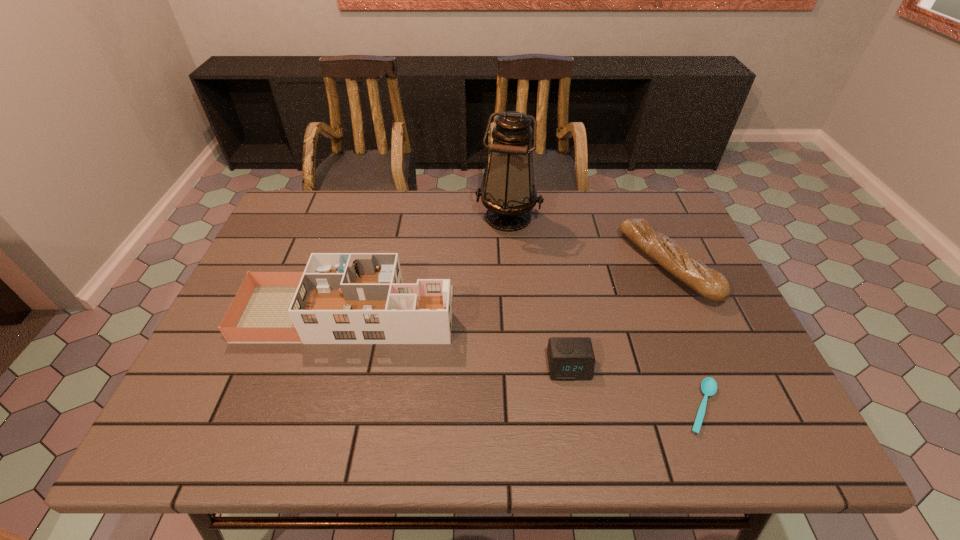
You are a GUI agent. You are given a task and a screenshot of the screen. Output one action in this format:
    pyautogui.click(x=<x>, y=<y>)
    Task: Click on the free space between the fourth tallest object and the spoon
    The height and width of the screenshot is (540, 960).
    Given the screenshot: What is the action you would take?
    pyautogui.click(x=636, y=387)

Locate an element on the screen. The width and height of the screenshot is (960, 540). vacant region between the spoon and the fourth tallest object is located at coordinates (636, 387).

At what (x,y) coordinates should I click in order to perform the action: click on free space between the third shortest object and the oil lamp. Please return your answer as a coordinate pair (x, y). This screenshot has height=540, width=960. Looking at the image, I should click on [588, 241].

Identify the location of vacant area that lies between the third shortest object and the oil lamp. (588, 241).

Where is `empty location between the second shortest object and the leftmost object`? The image size is (960, 540). empty location between the second shortest object and the leftmost object is located at coordinates (458, 340).

Locate which object ranks in proximity to the shortest object. Please provide its 2D coordinates. Your answer should be formatted as a tuple, i.e. [(x, y)], where the tuple contains the x and y coordinates of a point satisfying the conditions above.

[(569, 358)]

Select which object appears as the second closest to the second tallest object. Please provide its 2D coordinates. Your answer should be formatted as a tuple, i.e. [(x, y)], where the tuple contains the x and y coordinates of a point satisfying the conditions above.

[(569, 358)]

You are a GUI agent. You are given a task and a screenshot of the screen. Output one action in this format:
    pyautogui.click(x=<x>, y=<y>)
    Task: Click on the blank area in the image that satisfies the following two spatial constraints: 1. on the front-facing side of the fourth tallest object; 2. on the right side of the shortest object
    This screenshot has height=540, width=960.
    Given the screenshot: What is the action you would take?
    pyautogui.click(x=576, y=407)

At what (x,y) coordinates should I click in order to perform the action: click on free location that satisfies the following two spatial constraints: 1. on the front side of the spoon; 2. on the left side of the tallest object. Please return your answer as a coordinate pair (x, y). This screenshot has width=960, height=540. Looking at the image, I should click on (522, 407).

Where is `vacant space that satisfies the following two spatial constraints: 1. on the front side of the tallest object; 2. on the right side of the baguet`? The height and width of the screenshot is (540, 960). vacant space that satisfies the following two spatial constraints: 1. on the front side of the tallest object; 2. on the right side of the baguet is located at coordinates (512, 265).